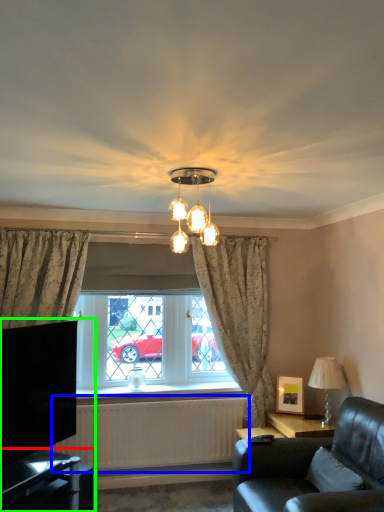
Question: Which object is the farthest from table (highlighted by a red box)? Choose among these: radiator (highlighted by a blue box) or entertainment center (highlighted by a green box).

Choices:
 (A) radiator
 (B) entertainment center

Answer: (A)